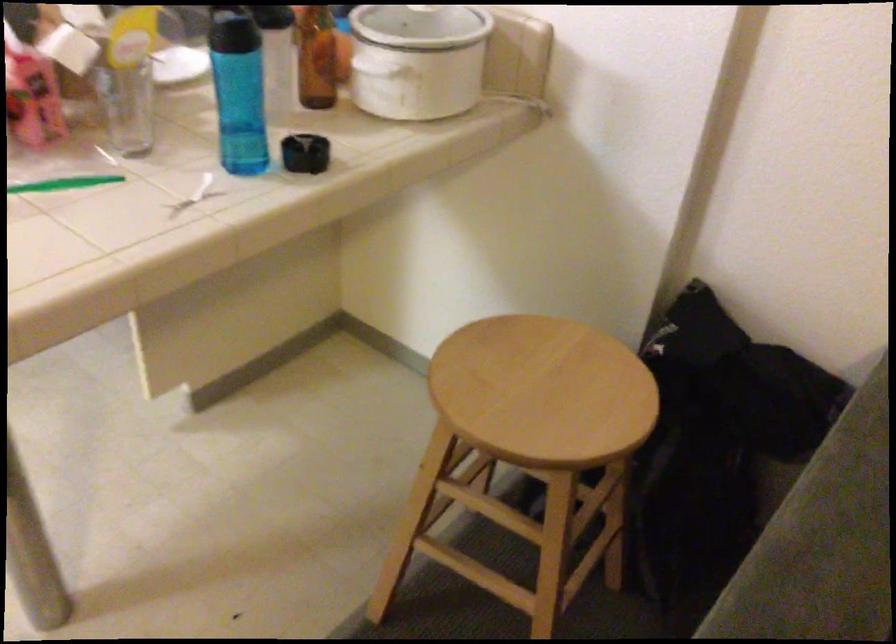
Where is `wooden stool seat`? The width and height of the screenshot is (896, 644). wooden stool seat is located at coordinates (543, 392).